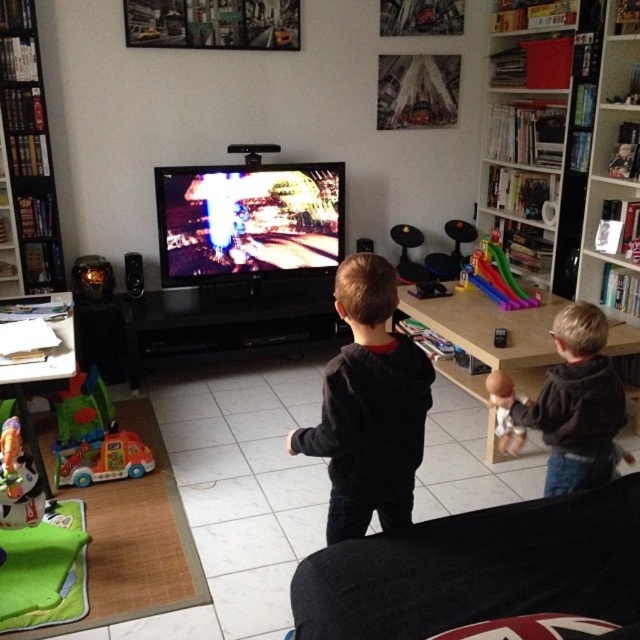
You are a parent who wants to place a new decorative item on the dark gray hoodie at center. Considering the height of the black plastic bookshelf at left, will the bookshelf block the view of the decorative item from the doorway?

The black plastic bookshelf at left has a greater height compared to dark gray hoodie at center, so placing the decorative item on the dark gray hoodie at center may be partially or fully obscured by the taller black plastic bookshelf at left from the doorway view.

You are standing in the living room and want to place a new plant on the floor at the point marked as point (179, 355). If your arm reaches 10 feet, can you comfortably reach that point without moving?

The distance of point (179, 355) from the camera is 12.32 feet, which is beyond the 10 feet reach of your arm. You cannot comfortably reach that point without moving.